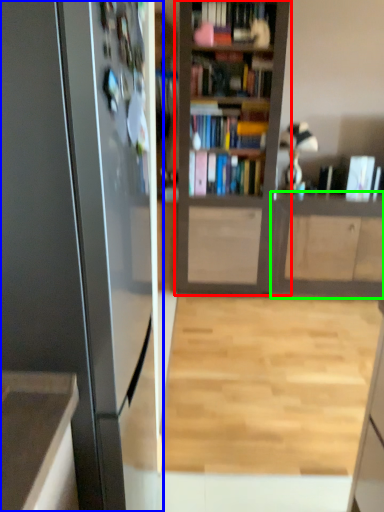
Question: Which object is the closest to the bookcase (highlighted by a red box)? Choose among these: appliance (highlighted by a blue box) or cabinetry (highlighted by a green box).

Choices:
 (A) appliance
 (B) cabinetry

Answer: (B)